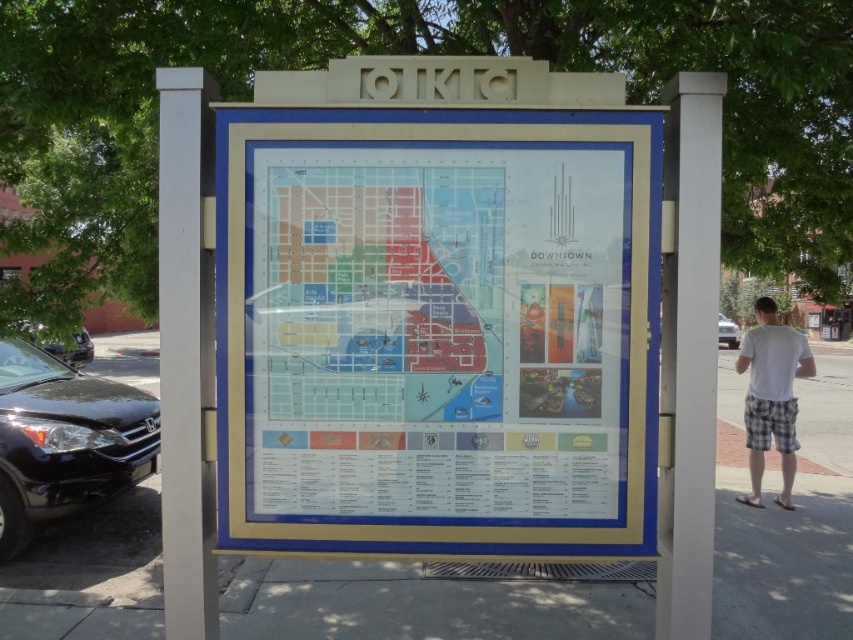
You are a tourist holding a smartphone and want to take a photo of the white plastic map at center and the gray concrete pavement at center. Which object will appear closer to the camera in the photo?

The white plastic map at center will appear closer to the camera in the photo because it is in front of the gray concrete pavement at center.

From the picture: You are a delivery person carrying a box that is 5 feet tall. You need to navigate through the area shown in the image. Can you safely pass between the white plastic map at center and the gray concrete pavement at center without hitting your head?

The distance between the white plastic map at center and the gray concrete pavement at center is 4.64 feet. Since your box is 5 feet tall, it is taller than the available space, so you cannot safely pass through without hitting your head.

You are a tourist in Oklahoma City and want to find the nearest restroom. You see the white plastic map at center and the matte plastic map at center on the informational board. Which map should you choose to get the most detailed information?

The white plastic map at center is larger in size than the matte plastic map at center, so it likely provides more detailed information about the area, including restroom locations.